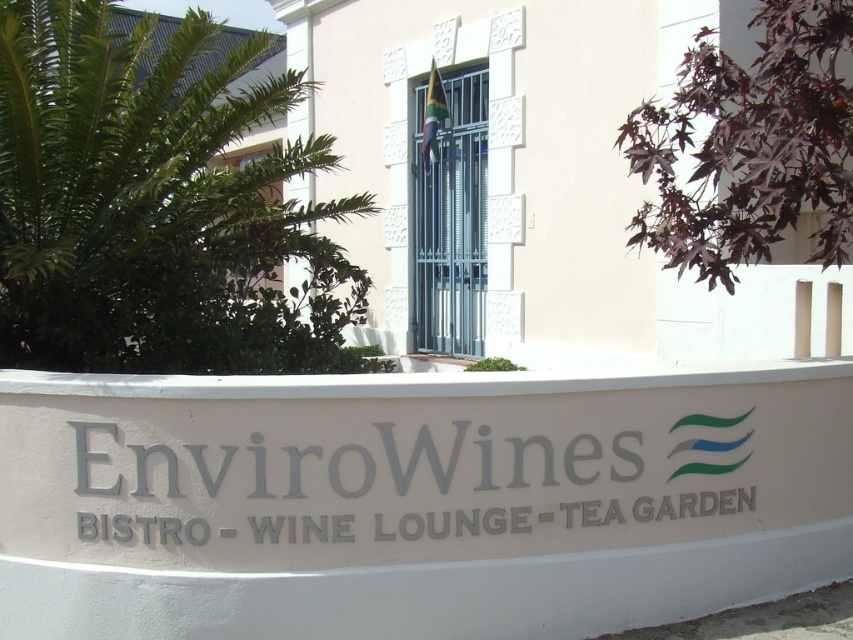
You are standing in front of the building and want to take a photo. The two points, point (x=320, y=522) and point (x=461, y=346), are on the signboard. Which point is closer to you when you take the photo?

Point (x=320, y=522) is closer to the camera than point (x=461, y=346), so it will be closer to you when you take the photo.

You are standing in front of the building and want to read the gray metallic sign at center. Is the metallic gate at center blocking your view of the sign?

The gray metallic sign at center is closer to the viewer than the metallic gate at center, so the gate is not blocking your view of the sign.

You are standing at the entrance of the building and want to take a photo of the signboard. The camera you have can only focus on objects within 10 feet. Is the point at coordinates point (370, 468) within the camera focus range?

The point at coordinates point (370, 468) is 12.48 feet away from the camera, which is beyond the 10 feet focus range. Therefore, the camera cannot focus on that point.